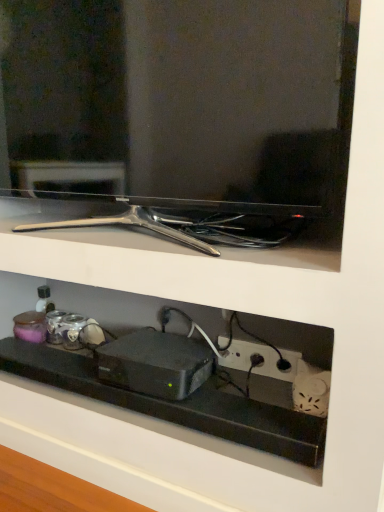
Question: Is black plastic shelf at lower center positioned with its back to matte black tv at upper center?

Choices:
 (A) no
 (B) yes

Answer: (A)

Question: Does black plastic shelf at lower center come behind matte black tv at upper center?

Choices:
 (A) yes
 (B) no

Answer: (A)

Question: Is black plastic shelf at lower center aimed at matte black tv at upper center?

Choices:
 (A) yes
 (B) no

Answer: (B)

Question: From the image's perspective, is black plastic shelf at lower center below matte black tv at upper center?

Choices:
 (A) no
 (B) yes

Answer: (B)

Question: Would you say black plastic shelf at lower center is a long distance from matte black tv at upper center?

Choices:
 (A) yes
 (B) no

Answer: (B)

Question: From the image's perspective, is black plastic shelf at lower center over matte black tv at upper center?

Choices:
 (A) yes
 (B) no

Answer: (B)

Question: Is black plastic device at center surrounded by matte black tv at upper center?

Choices:
 (A) yes
 (B) no

Answer: (B)

Question: Considering the relative sizes of matte black tv at upper center and black plastic device at center in the image provided, is matte black tv at upper center bigger than black plastic device at center?

Choices:
 (A) no
 (B) yes

Answer: (B)

Question: Does matte black tv at upper center have a lesser width compared to black plastic device at center?

Choices:
 (A) no
 (B) yes

Answer: (B)

Question: Would you say matte black tv at upper center is outside black plastic device at center?

Choices:
 (A) yes
 (B) no

Answer: (A)

Question: Are matte black tv at upper center and black plastic device at center making contact?

Choices:
 (A) no
 (B) yes

Answer: (A)

Question: Can you confirm if matte black tv at upper center is wider than black plastic device at center?

Choices:
 (A) no
 (B) yes

Answer: (A)

Question: Is black plastic shelf at lower center thinner than black plastic power outlet at lower right?

Choices:
 (A) yes
 (B) no

Answer: (B)